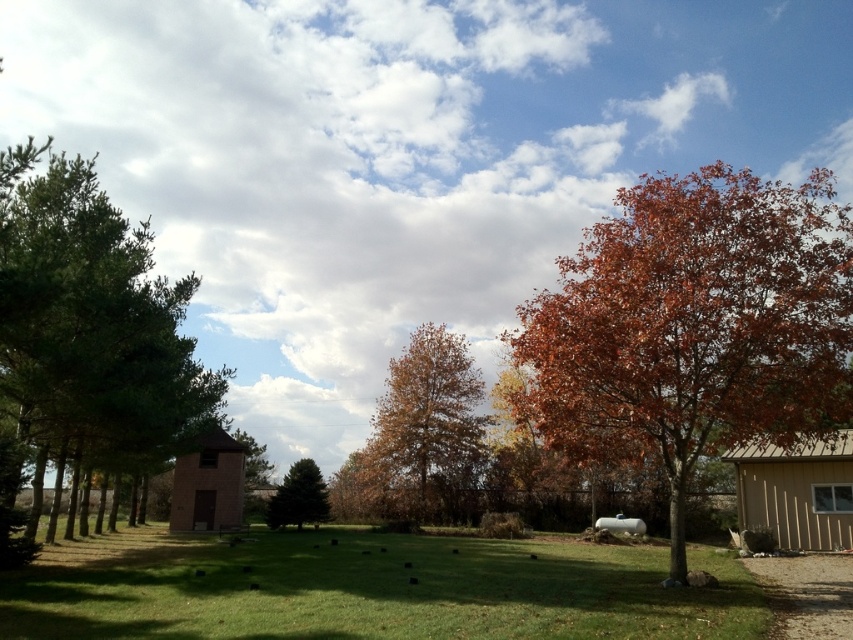
Is green leafy tree at left bigger than brown textured tree at center?

Yes.

Can you confirm if green leafy tree at left is positioned above brown textured tree at center?

Yes.

Is point (26, 243) positioned in front of point (381, 502)?

Yes, point (26, 243) is closer to viewer.

I want to click on green leafy tree at left, so click(85, 337).

Where is `green grass at center`? This screenshot has width=853, height=640. green grass at center is located at coordinates (370, 589).

Is green grass at center to the left of green matte evergreen tree at center from the viewer's perspective?

Incorrect, green grass at center is not on the left side of green matte evergreen tree at center.

Is point (653, 612) behind point (312, 470)?

No, it is not.

At what (x,y) coordinates should I click in order to perform the action: click on green grass at center. Please return your answer as a coordinate pair (x, y). The height and width of the screenshot is (640, 853). Looking at the image, I should click on (370, 589).

Does autumn leaves tree at right have a larger size compared to green leafy tree at left?

Incorrect, autumn leaves tree at right is not larger than green leafy tree at left.

Who is shorter, autumn leaves tree at right or green leafy tree at left?

autumn leaves tree at right

Is point (585, 458) farther from camera compared to point (164, 433)?

No.

I want to click on autumn leaves tree at right, so click(x=694, y=326).